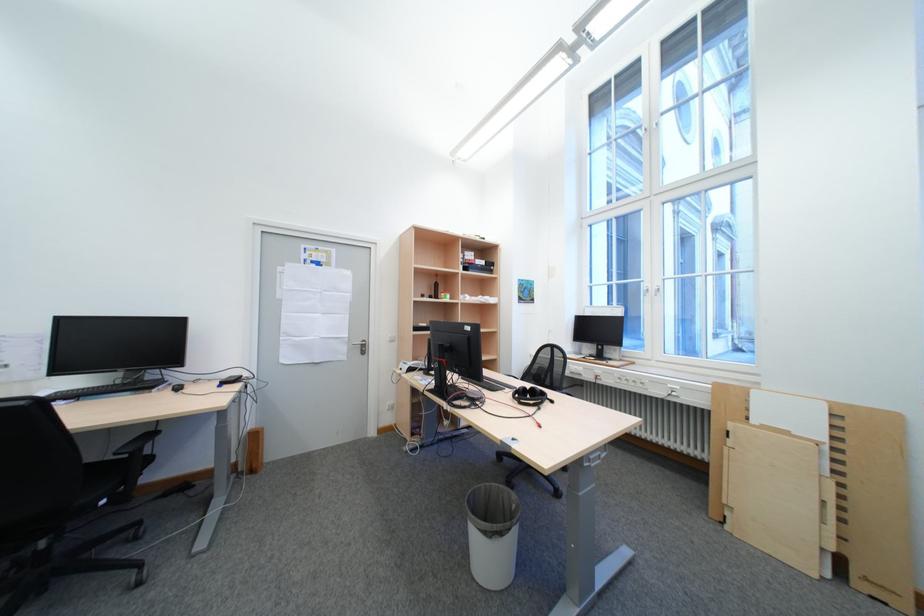
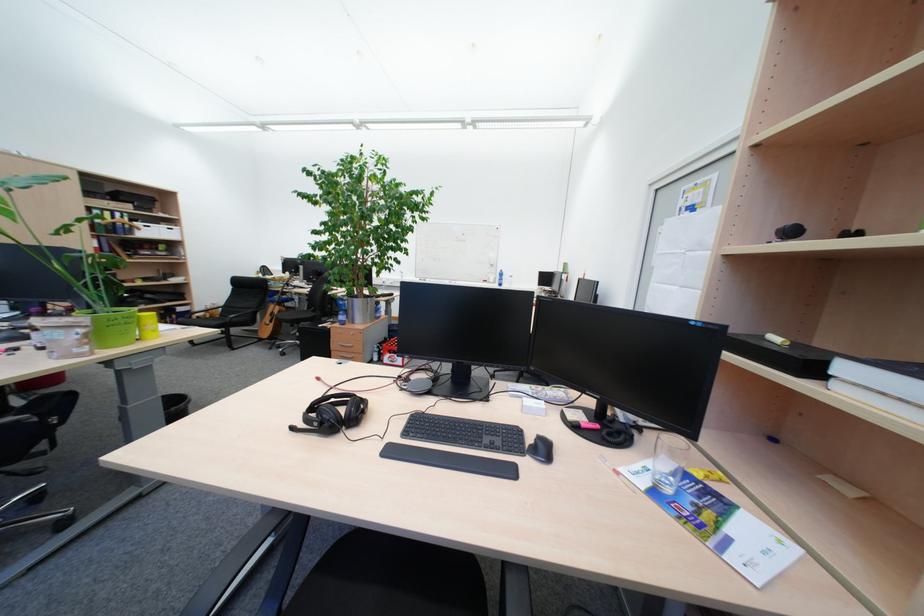
Where in the second image is the point corresponding to (x=292, y=270) from the first image?

(671, 230)